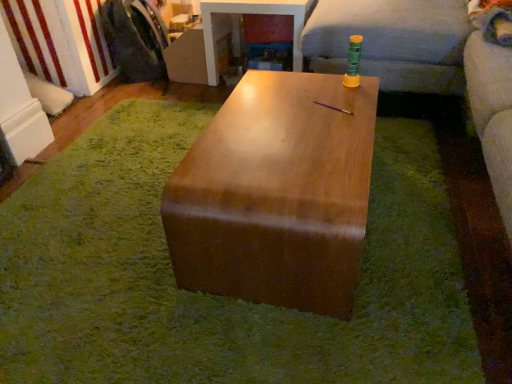
Question: From a real-world perspective, does glossy wood table at center, which is the 1th table in back-to-front order, sit lower than wooden table at center?

Choices:
 (A) no
 (B) yes

Answer: (A)

Question: Is glossy wood table at center, the first table viewed from the top, bigger than wooden table at center?

Choices:
 (A) no
 (B) yes

Answer: (B)

Question: From the image's perspective, does glossy wood table at center, which is the 1th table in back-to-front order, appear higher than wooden table at center?

Choices:
 (A) yes
 (B) no

Answer: (A)

Question: Is wooden table at center surrounded by glossy wood table at center, arranged as the 2th table when viewed from the front?

Choices:
 (A) yes
 (B) no

Answer: (B)

Question: From a real-world perspective, is glossy wood table at center, the first table viewed from the top, on top of wooden table at center?

Choices:
 (A) yes
 (B) no

Answer: (A)

Question: Is brushed metal washing machine at left inside the boundaries of wooden table at center, or outside?

Choices:
 (A) outside
 (B) inside

Answer: (A)

Question: From a real-world perspective, is brushed metal washing machine at left physically located above or below wooden table at center?

Choices:
 (A) below
 (B) above

Answer: (B)

Question: In terms of height, does brushed metal washing machine at left look taller or shorter compared to wooden table at center?

Choices:
 (A) tall
 (B) short

Answer: (A)

Question: Relative to wooden table at center, is brushed metal washing machine at left in front or behind?

Choices:
 (A) behind
 (B) front

Answer: (A)

Question: From the image's perspective, is soft gray fabric couch at upper right above or below wooden table at center?

Choices:
 (A) above
 (B) below

Answer: (A)

Question: Considering the positions of soft gray fabric couch at upper right and wooden table at center in the image, is soft gray fabric couch at upper right wider or thinner than wooden table at center?

Choices:
 (A) wide
 (B) thin

Answer: (B)

Question: Does point (409, 84) appear closer or farther from the camera than point (328, 324)?

Choices:
 (A) closer
 (B) farther

Answer: (B)

Question: From their relative heights in the image, would you say soft gray fabric couch at upper right is taller or shorter than wooden table at center?

Choices:
 (A) tall
 (B) short

Answer: (A)

Question: From their relative heights in the image, would you say glossy wood table at center, the 2th table when ordered from top to bottom, is taller or shorter than soft gray fabric couch at upper right?

Choices:
 (A) tall
 (B) short

Answer: (B)

Question: From the image's perspective, relative to soft gray fabric couch at upper right, is glossy wood table at center, the 2th table when ordered from top to bottom, above or below?

Choices:
 (A) below
 (B) above

Answer: (A)